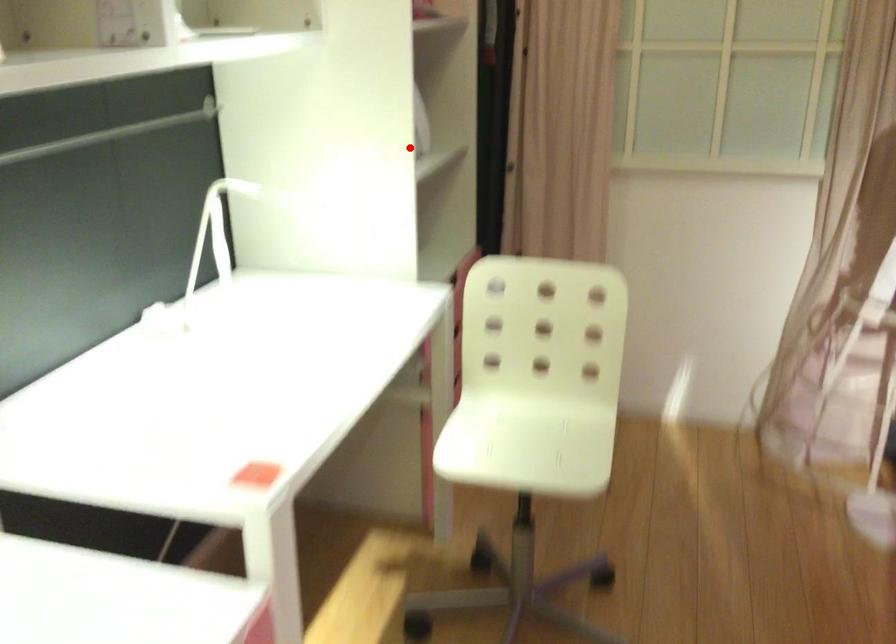
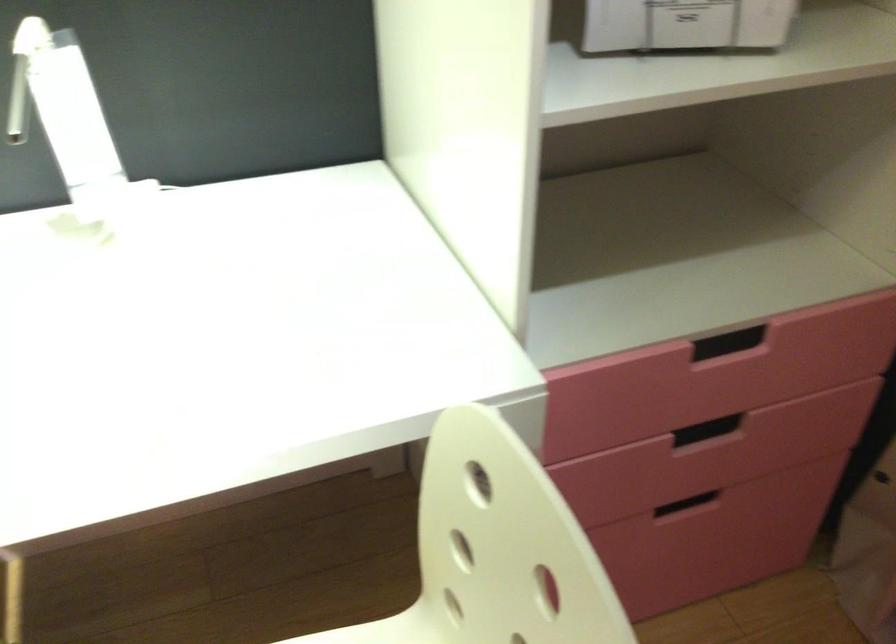
Where in the second image is the point corresponding to the highlighted location from the first image?

(685, 24)